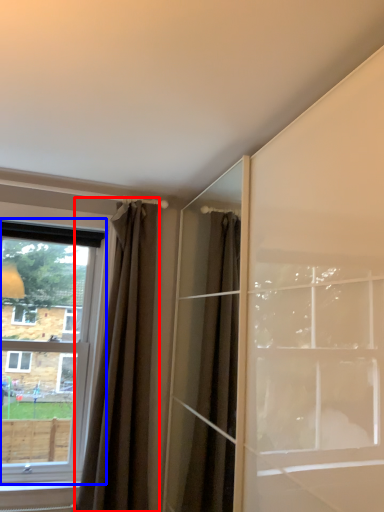
Question: Among these objects, which one is farthest to the camera, curtain (highlighted by a red box) or window (highlighted by a blue box)?

Choices:
 (A) curtain
 (B) window

Answer: (B)